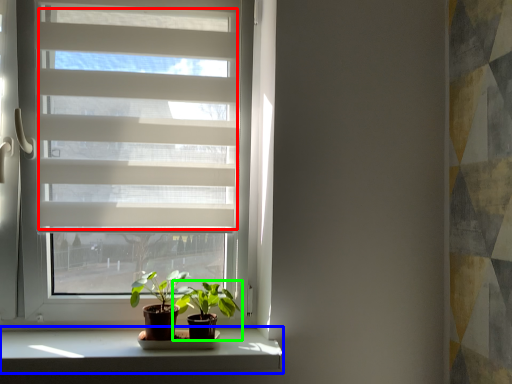
Question: Which object is the farthest from blind (highlighted by a red box)? Choose among these: window sill (highlighted by a blue box) or houseplant (highlighted by a green box).

Choices:
 (A) window sill
 (B) houseplant

Answer: (A)